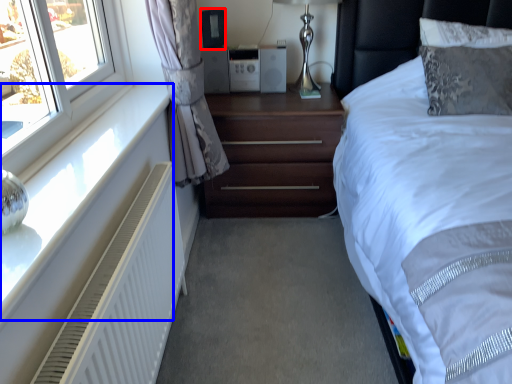
Question: Which object appears farthest to the camera in this image, speaker (highlighted by a red box) or window sill (highlighted by a blue box)?

Choices:
 (A) speaker
 (B) window sill

Answer: (A)